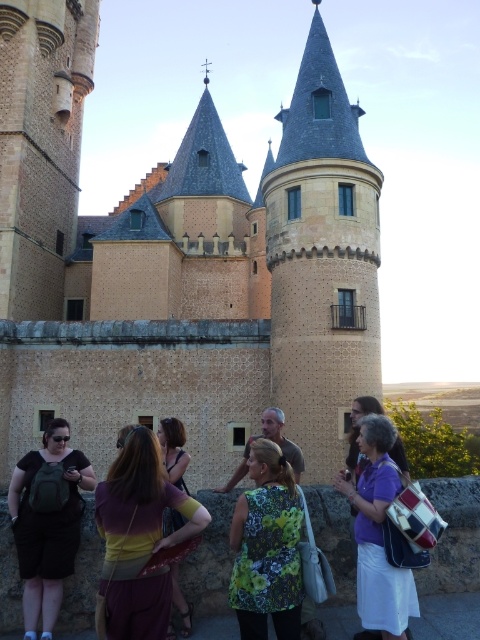
Question: Which object appears farthest from the camera in this image?

Choices:
 (A) purple fabric purse at center
 (B) brown stone castle at center
 (C) floral dress at center
 (D) matte black backpack at lower left

Answer: (B)

Question: Which object appears closest to the camera in this image?

Choices:
 (A) brown stone castle at center
 (B) purple fabric purse at center

Answer: (B)

Question: Which object is positioned farthest from the floral fabric vest at center?

Choices:
 (A) floral print shirt at center
 (B) maroon fabric dress at center
 (C) purple fabric purse at center
 (D) brick stonework tower at center

Answer: (D)

Question: Is the position of floral fabric vest at center less distant than that of purple fabric purse at center?

Choices:
 (A) no
 (B) yes

Answer: (A)

Question: Is maroon fabric dress at center closer to the viewer compared to floral fabric vest at center?

Choices:
 (A) no
 (B) yes

Answer: (B)

Question: Does matte black backpack at lower left have a greater width compared to floral dress at center?

Choices:
 (A) yes
 (B) no

Answer: (B)